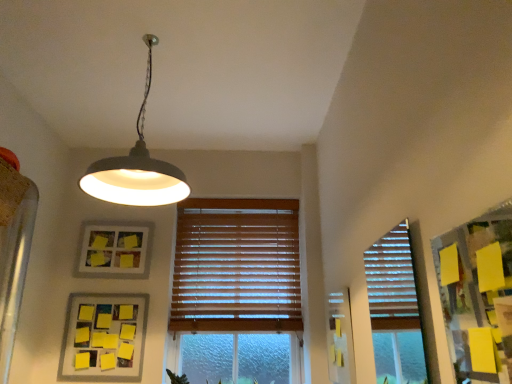
Question: Does yellow matte picture frame at lower left, which appears as the 1th picture frame when viewed from the front, appear on the left side of wooden blinds at center?

Choices:
 (A) no
 (B) yes

Answer: (B)

Question: Would you say yellow matte picture frame at lower left, marked as the first picture frame in a bottom-to-top arrangement, is outside wooden blinds at center?

Choices:
 (A) no
 (B) yes

Answer: (B)

Question: Is yellow matte picture frame at lower left, which appears as the 1th picture frame when viewed from the front, looking in the opposite direction of wooden blinds at center?

Choices:
 (A) no
 (B) yes

Answer: (A)

Question: Does yellow matte picture frame at lower left, which appears as the 1th picture frame when viewed from the front, have a lesser width compared to wooden blinds at center?

Choices:
 (A) yes
 (B) no

Answer: (A)

Question: From the image's perspective, is yellow matte picture frame at lower left, which appears as the 1th picture frame when viewed from the front, under wooden blinds at center?

Choices:
 (A) yes
 (B) no

Answer: (A)

Question: Does yellow matte picture frame at lower left, placed as the second picture frame when sorted from top to bottom, turn towards wooden blinds at center?

Choices:
 (A) no
 (B) yes

Answer: (A)

Question: From the image's perspective, does yellow matte picture frame at lower left, which is the 2th picture frame from back to front, appear higher than yellow matte picture frame at upper left, placed as the 1th picture frame when sorted from back to front?

Choices:
 (A) no
 (B) yes

Answer: (A)

Question: Are yellow matte picture frame at lower left, placed as the second picture frame when sorted from top to bottom, and yellow matte picture frame at upper left, which appears as the 2th picture frame when viewed from the front, far apart?

Choices:
 (A) no
 (B) yes

Answer: (A)

Question: Considering the relative sizes of yellow matte picture frame at lower left, which is the 2th picture frame from back to front, and yellow matte picture frame at upper left, the first picture frame viewed from the top, in the image provided, is yellow matte picture frame at lower left, which is the 2th picture frame from back to front, smaller than yellow matte picture frame at upper left, the first picture frame viewed from the top,?

Choices:
 (A) yes
 (B) no

Answer: (B)

Question: Is yellow matte picture frame at lower left, which is the 2th picture frame from back to front, in front of yellow matte picture frame at upper left, placed as the 1th picture frame when sorted from back to front?

Choices:
 (A) yes
 (B) no

Answer: (A)

Question: Is yellow matte picture frame at lower left, marked as the first picture frame in a bottom-to-top arrangement, positioned with its back to yellow matte picture frame at upper left, placed as the 1th picture frame when sorted from back to front?

Choices:
 (A) no
 (B) yes

Answer: (A)

Question: Can you confirm if yellow matte picture frame at lower left, which is the 2th picture frame from back to front, is positioned to the left of yellow matte picture frame at upper left, which is the second picture frame in bottom-to-top order?

Choices:
 (A) yes
 (B) no

Answer: (A)

Question: From a real-world perspective, is matte gray lampshade at upper center under wooden blinds at center?

Choices:
 (A) yes
 (B) no

Answer: (B)